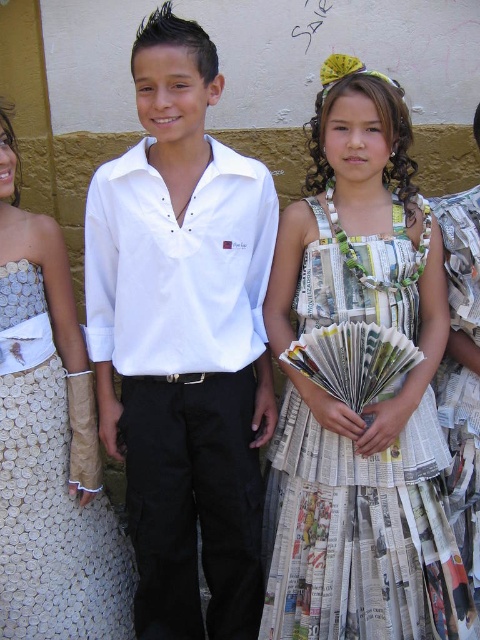
Based on the photo, who is positioned more to the right, white cotton shirt at center or recycled paper dress at center?

From the viewer's perspective, recycled paper dress at center appears more on the right side.

Which is in front, point (254, 576) or point (335, 476)?

Point (335, 476) is in front.

The height and width of the screenshot is (640, 480). I want to click on white cotton shirt at center, so click(x=183, y=339).

Is recycled paper dress at center bigger than white textured fabric dress at center?

Indeed, recycled paper dress at center has a larger size compared to white textured fabric dress at center.

Does point (312, 465) lie in front of point (87, 628)?

That is True.

I want to click on recycled paper dress at center, so click(x=360, y=534).

This screenshot has width=480, height=640. Find the location of `recycled paper dress at center`. recycled paper dress at center is located at coordinates (360, 534).

Is white cotton shirt at center thinner than white textured fabric dress at center?

Incorrect, white cotton shirt at center's width is not less than white textured fabric dress at center's.

Who is shorter, white cotton shirt at center or white textured fabric dress at center?

white textured fabric dress at center

Between point (247, 406) and point (63, 604), which one is positioned behind?

Point (63, 604)

This screenshot has height=640, width=480. In order to click on white cotton shirt at center in this screenshot , I will do `click(183, 339)`.